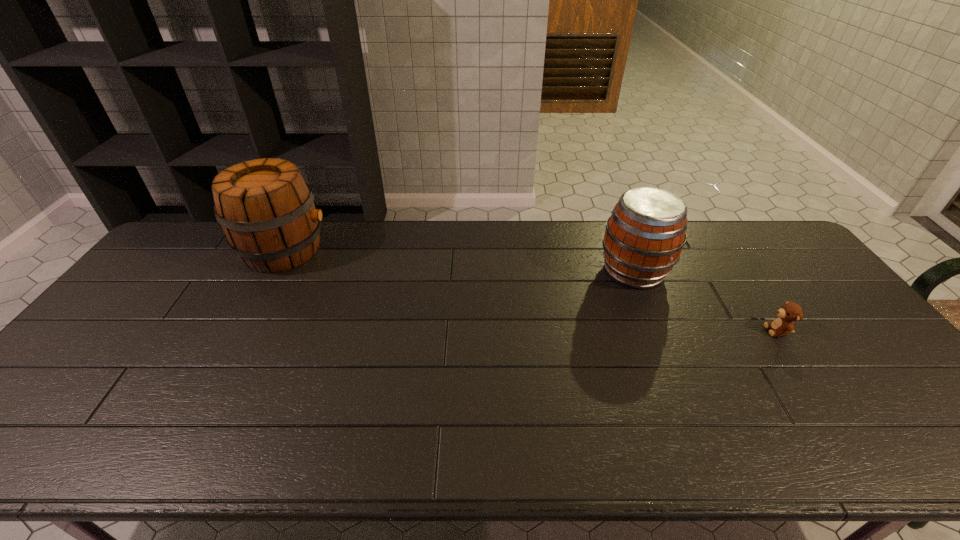
Where is `blank space at the near edge of the desktop`? The width and height of the screenshot is (960, 540). blank space at the near edge of the desktop is located at coordinates (121, 454).

This screenshot has width=960, height=540. Find the location of `vacant area at the left edge of the desktop`. vacant area at the left edge of the desktop is located at coordinates [x=98, y=355].

Where is `free point at the near left corner`? The width and height of the screenshot is (960, 540). free point at the near left corner is located at coordinates (13, 447).

At what (x,y) coordinates should I click in order to perform the action: click on free space between the rightmost object and the second object from left to right. Please return your answer as a coordinate pair (x, y). Looking at the image, I should click on (706, 301).

The width and height of the screenshot is (960, 540). Find the location of `vacant point located between the second object from left to right and the rightmost object`. vacant point located between the second object from left to right and the rightmost object is located at coordinates [706, 301].

At what (x,y) coordinates should I click in order to perform the action: click on free space between the left cider and the second object from left to right. Please return your answer as a coordinate pair (x, y). The width and height of the screenshot is (960, 540). Looking at the image, I should click on (459, 261).

You are a GUI agent. You are given a task and a screenshot of the screen. Output one action in this format:
    pyautogui.click(x=<x>, y=<y>)
    Task: Click on the vacant area between the second object from left to right and the nearest object
    This screenshot has width=960, height=540.
    Given the screenshot: What is the action you would take?
    pyautogui.click(x=706, y=301)

This screenshot has width=960, height=540. In order to click on free space between the second object from right to left and the nearest object in this screenshot , I will do `click(706, 301)`.

You are a GUI agent. You are given a task and a screenshot of the screen. Output one action in this format:
    pyautogui.click(x=<x>, y=<y>)
    Task: Click on the free spot between the rightmost object and the right cider
    
    Given the screenshot: What is the action you would take?
    pyautogui.click(x=706, y=301)

You are a GUI agent. You are given a task and a screenshot of the screen. Output one action in this format:
    pyautogui.click(x=<x>, y=<y>)
    Task: Click on the empty space between the right cider and the left cider
    This screenshot has width=960, height=540.
    Given the screenshot: What is the action you would take?
    pyautogui.click(x=459, y=261)